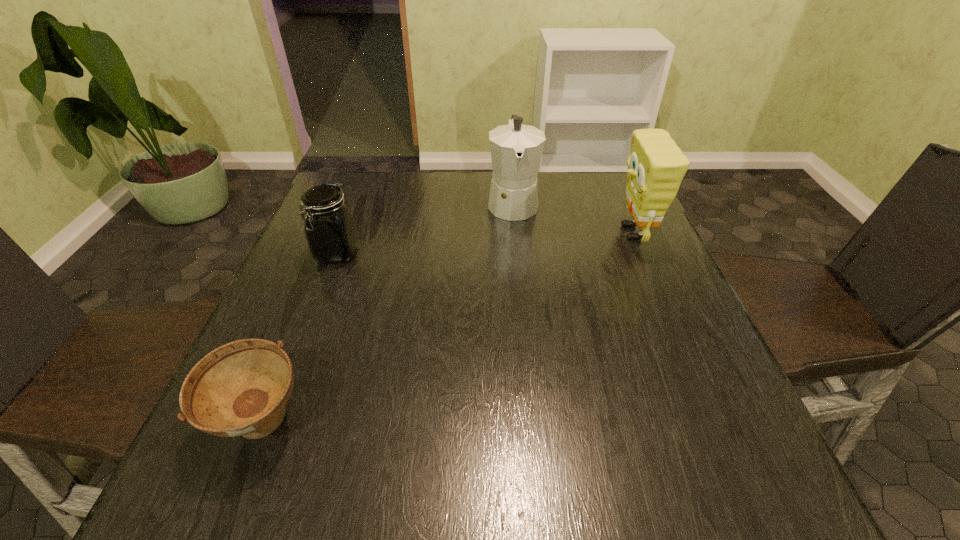
Locate an element on the screen. This screenshot has height=540, width=960. vacant space at the near edge of the desktop is located at coordinates (517, 467).

Where is `vacant space at the left edge of the desktop`? This screenshot has height=540, width=960. vacant space at the left edge of the desktop is located at coordinates (290, 300).

The height and width of the screenshot is (540, 960). In the image, there is a desktop. Identify the location of vacant space at the right edge. (694, 332).

Locate an element on the screen. Image resolution: width=960 pixels, height=540 pixels. free space at the far left corner is located at coordinates (349, 206).

You are a GUI agent. You are given a task and a screenshot of the screen. Output one action in this format:
    pyautogui.click(x=<x>, y=<y>)
    Task: Click on the free space at the far right corner of the desktop
    Image resolution: width=960 pixels, height=540 pixels.
    Given the screenshot: What is the action you would take?
    [x=611, y=176]

In order to click on vacant space in between the soup bowl and the third object from left to right in this screenshot , I will do `click(388, 314)`.

Where is `free space between the third object from left to right and the jar`? Image resolution: width=960 pixels, height=540 pixels. free space between the third object from left to right and the jar is located at coordinates point(425,228).

You are a GUI agent. You are given a task and a screenshot of the screen. Output one action in this format:
    pyautogui.click(x=<x>, y=<y>)
    Task: Click on the free spot between the coffeepot and the jar
    Image resolution: width=960 pixels, height=540 pixels.
    Given the screenshot: What is the action you would take?
    pyautogui.click(x=425, y=228)

Identify the location of free space between the sponge and the jar. Image resolution: width=960 pixels, height=540 pixels. (485, 243).

Identify the location of free spot between the third tallest object and the shortest object. Image resolution: width=960 pixels, height=540 pixels. (300, 339).